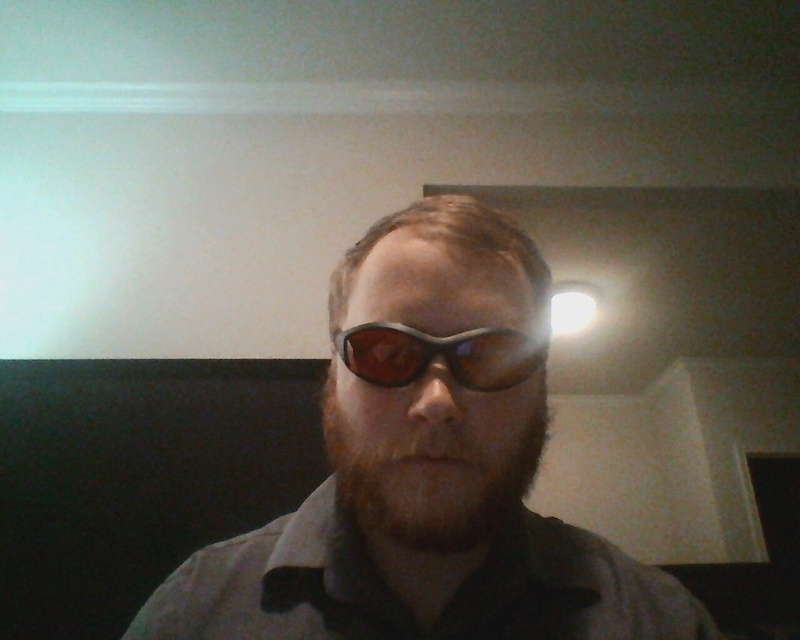
You are trying to decide between the matte black sunglasses at center and the matte black goggles at center for an outdoor activity. Which one has a taller frame?

The matte black sunglasses at center has a taller frame than the matte black goggles at center.

You are a photographer adjusting lighting in a dim room. You notice the matte black sunglasses at center and the brown fuzzy beard at center. Which object should you focus on first if you want to ensure the taller one is properly lit?

The matte black sunglasses at center is taller than the brown fuzzy beard at center, so you should focus on the matte black sunglasses at center first to ensure proper lighting.

You are a photographer adjusting the camera focus. The subject has matte black sunglasses at center and brown fuzzy beard at center. Which object should you focus on first to ensure the subject looks sharp in the photo?

You should focus on the matte black sunglasses at center first since it is in front of the brown fuzzy beard at center, ensuring both are in focus by starting with the closer object.